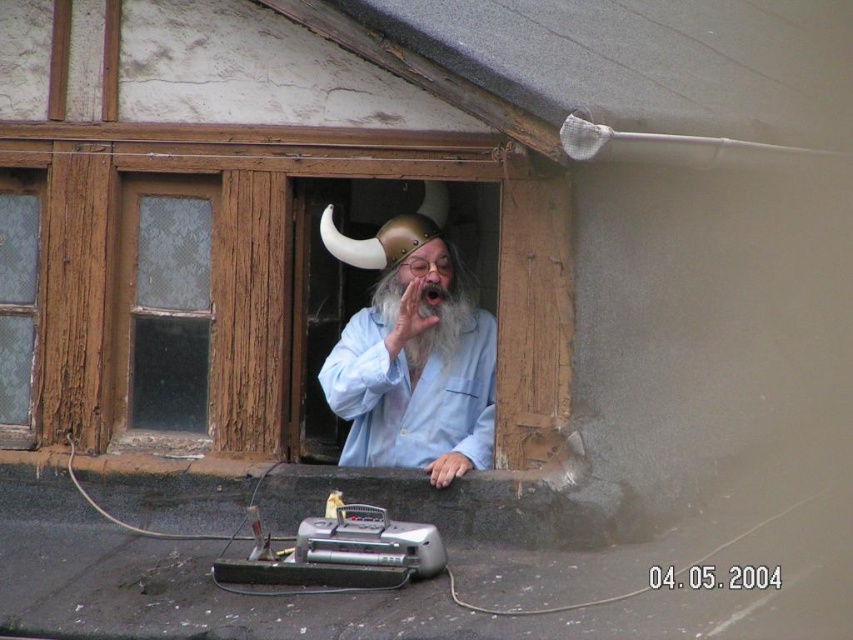
Is matte gold helmet at center bigger than clear glass window at left?

Indeed, matte gold helmet at center has a larger size compared to clear glass window at left.

Who is more distant from viewer, (x=489, y=324) or (x=0, y=198)?

Point (x=0, y=198)

The height and width of the screenshot is (640, 853). What do you see at coordinates (412, 356) in the screenshot?
I see `matte gold helmet at center` at bounding box center [412, 356].

Where is `matte gold helmet at center`? matte gold helmet at center is located at coordinates (412, 356).

Does clear glass door at left appear on the right side of clear glass window at left?

Yes, clear glass door at left is to the right of clear glass window at left.

Does clear glass door at left appear on the left side of clear glass window at left?

No, clear glass door at left is not to the left of clear glass window at left.

Does point (138, 312) lie in front of point (0, 202)?

Yes, point (138, 312) is closer to viewer.

Identify the location of clear glass door at left. This screenshot has width=853, height=640. click(x=164, y=314).

Is point (361, 253) positioned behind point (172, 385)?

No, (361, 253) is in front of (172, 385).

Between point (328, 376) and point (136, 346), which one is positioned behind?

The point (136, 346) is more distant.

Identify the location of matte gold helmet at center. This screenshot has height=640, width=853. (412, 356).